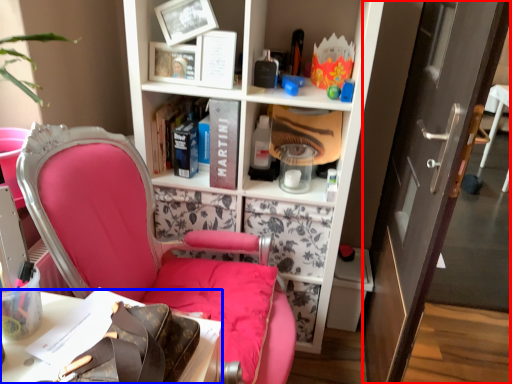
Question: Which object is closer to the camera taking this photo, door (highlighted by a red box) or desk (highlighted by a blue box)?

Choices:
 (A) door
 (B) desk

Answer: (B)